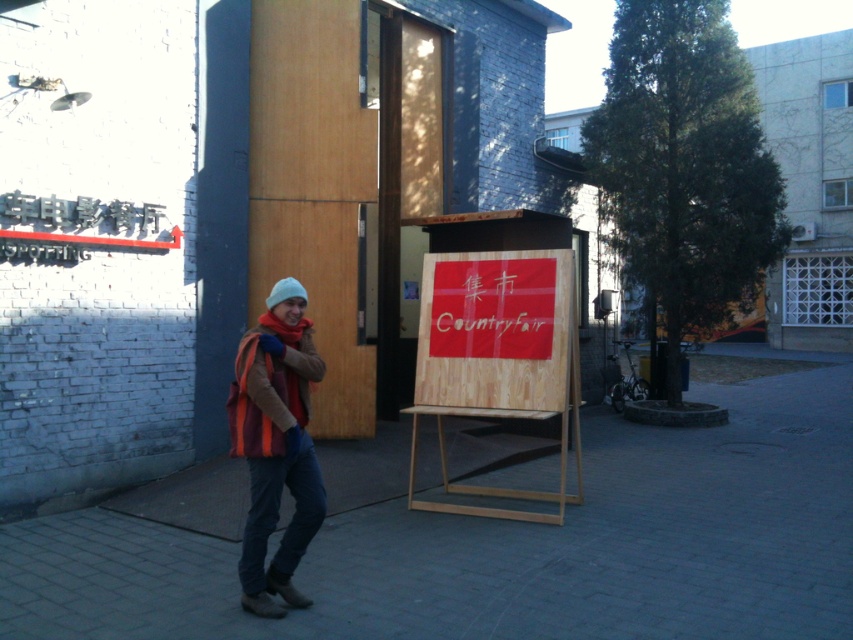
You are a fashion designer observing a pedestrian in an urban setting. You notice the knitted woolen hat at center and the brown suede jacket at center. Which clothing item is located to the right of the other?

The knitted woolen hat at center is positioned on the right side of brown suede jacket at center.

You are a delivery person who needs to deliver a package to the address marked by the red arrow on the white brick wall. You are currently standing at the brown suede jacket at center. Which direction should you move to reach the brick pavement at center, which is part of the path leading to the wall?

The brick pavement at center is to the right of the brown suede jacket at center, so you should move to your right to reach the brick pavement at center and proceed towards the wall.